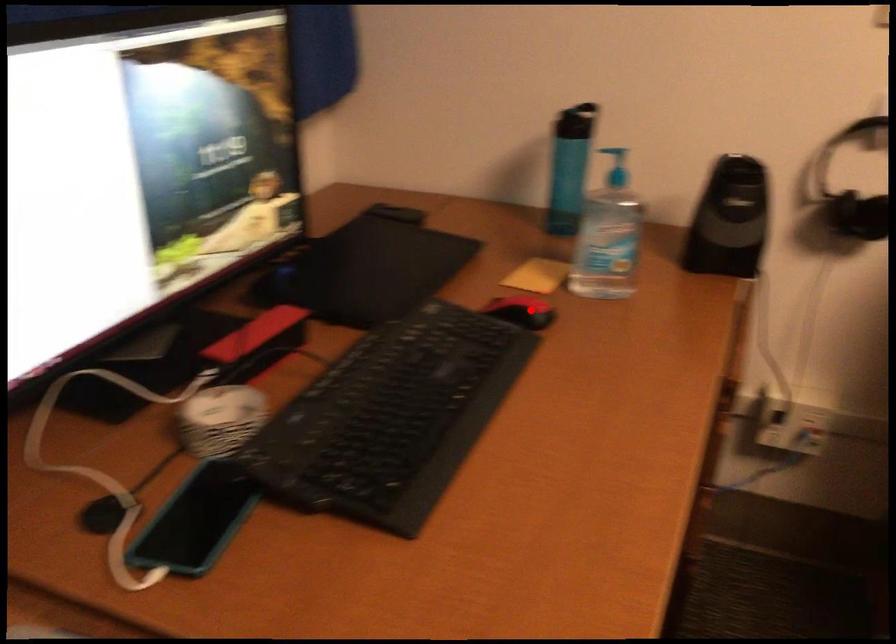
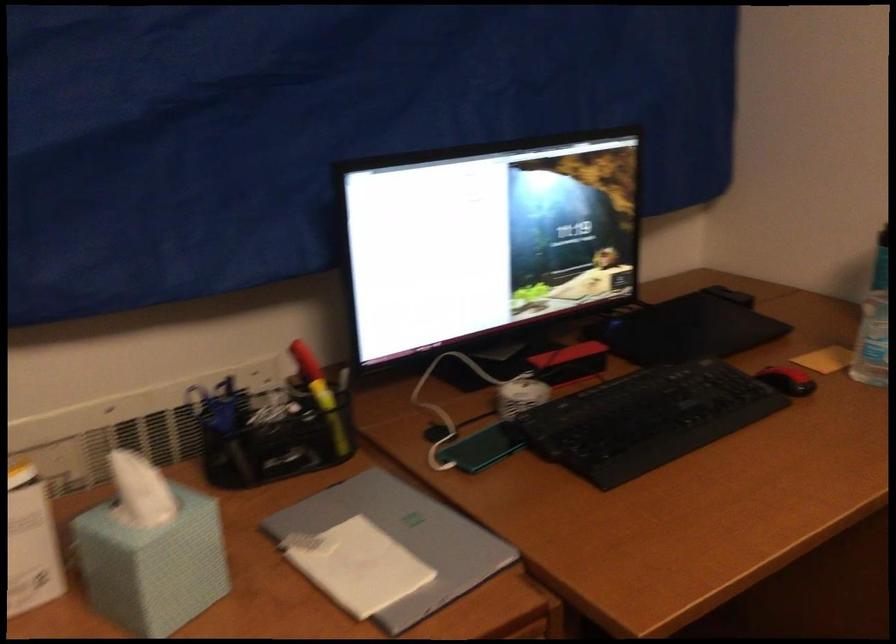
Question: A red point is marked in image1. In image2, is the corresponding 3D point closer to the camera or farther? Reply with the corresponding letter.

Choices:
 (A) The corresponding 3D point is closer.
 (B) The corresponding 3D point is farther.

Answer: (B)